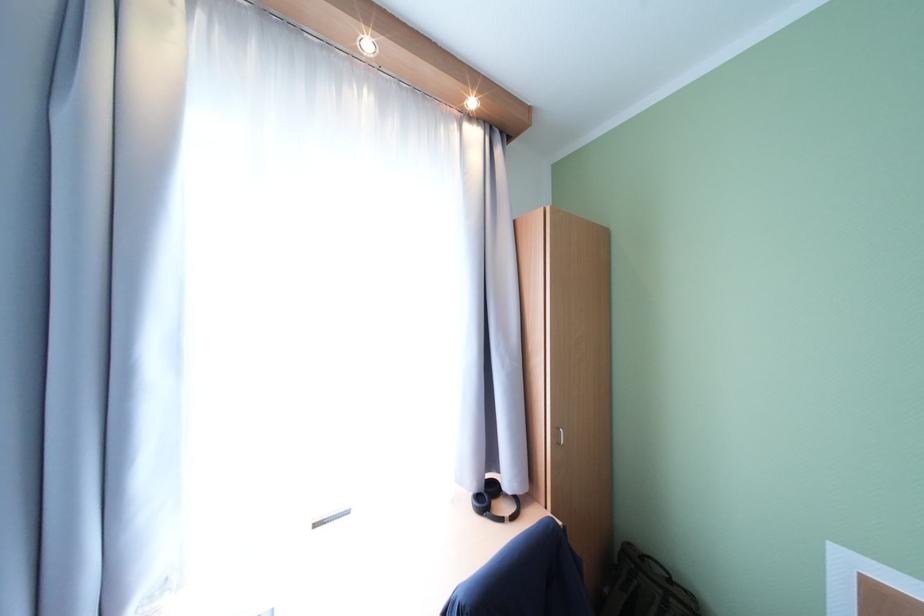
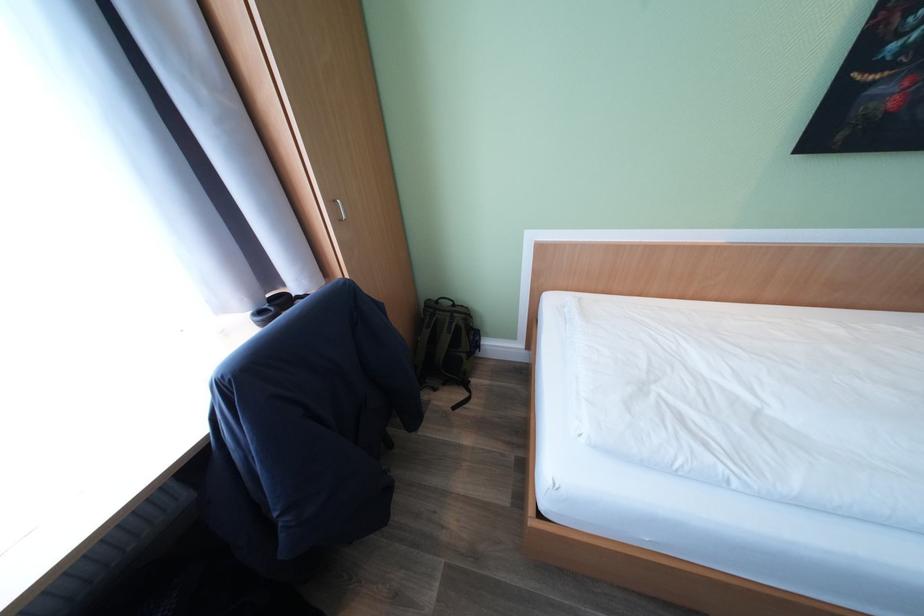
How did the camera likely rotate?

The camera's rotation is toward right-down.